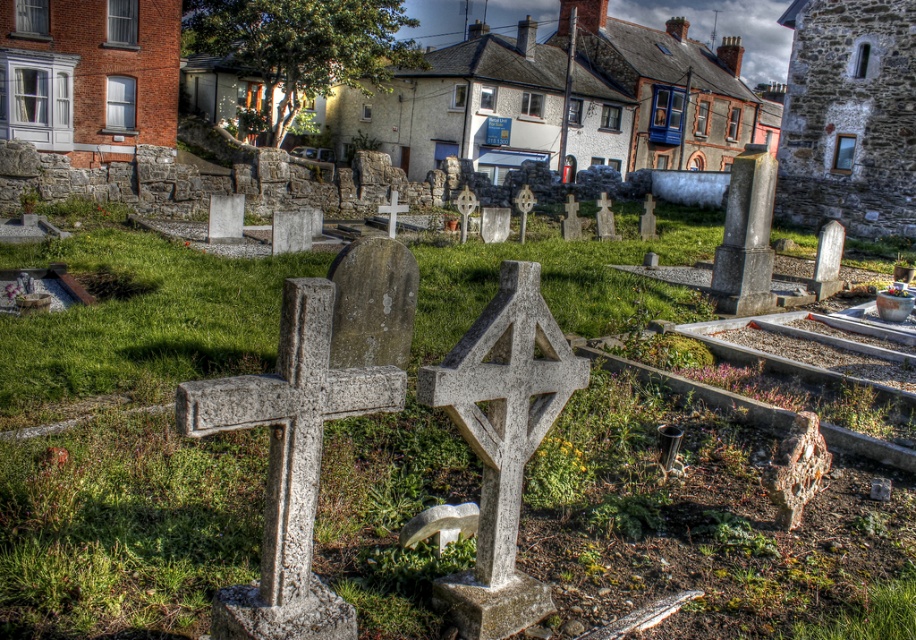
You are standing in the cemetery and want to take a photo of both the white stone cross at center and the smooth stone cross at center. Since you can only focus on one at a time, which cross should you focus on first to ensure it appears sharp in the photo?

The white stone cross at center is in front of the smooth stone cross at center, so you should focus on the white stone cross at center first to ensure it appears sharp in the photo.

From the picture: You are standing in the cemetery and want to find the white stone cross at center and the smooth stone cross at center. According to the scene, which one is positioned lower?

The white stone cross at center is located below the smooth stone cross at center, so the white stone cross at center is positioned lower.

You are standing in a cemetery and want to place a new flowerpot that is 10 feet long in front of the white stone cross at center. Can you fit the flowerpot in front of it without moving the cross?

The white stone cross at center is 9.92 feet from viewer. Since the flowerpot is 10 feet long, it would extend beyond the cross, so it won not fit without moving the cross.